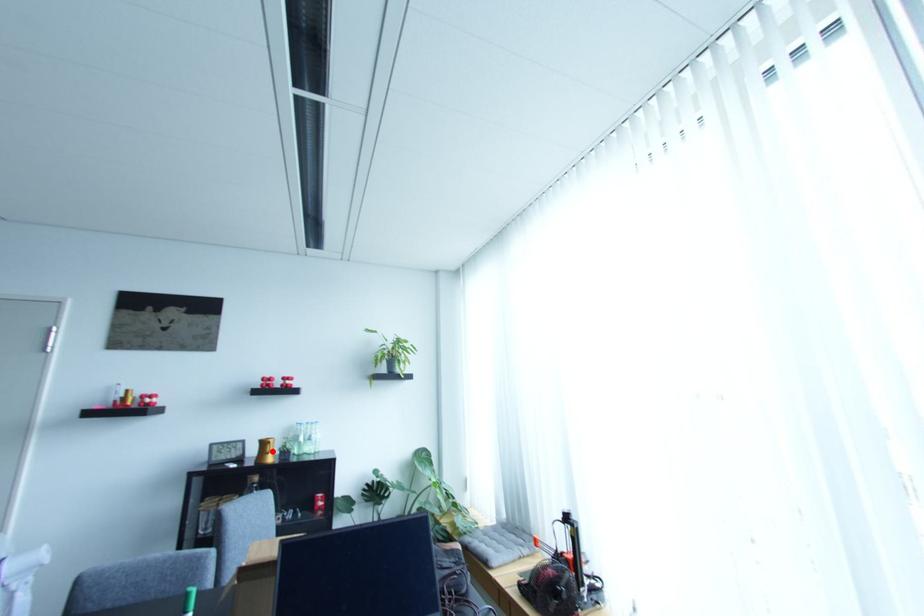
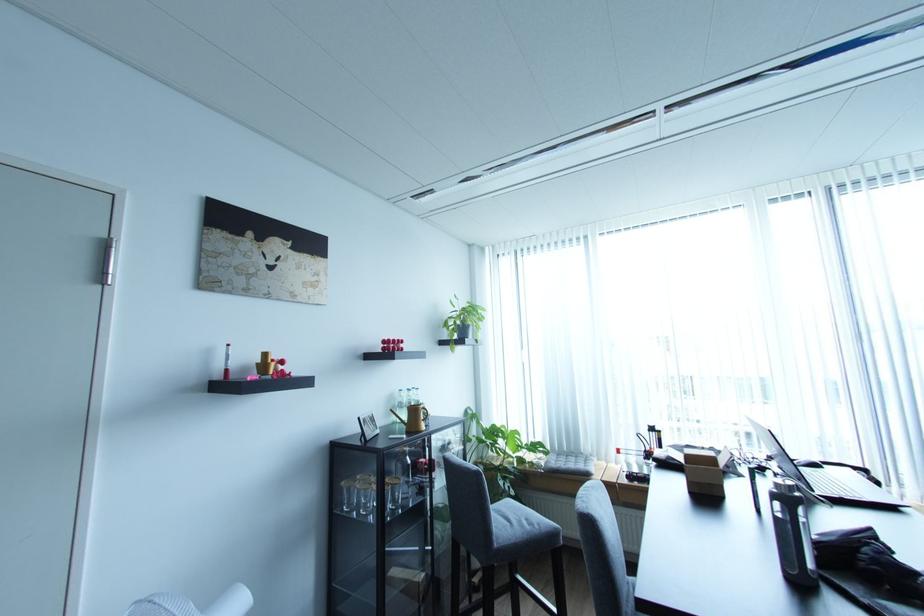
The point at the highlighted location is marked in the first image. Where is the corresponding point in the second image?

(426, 418)